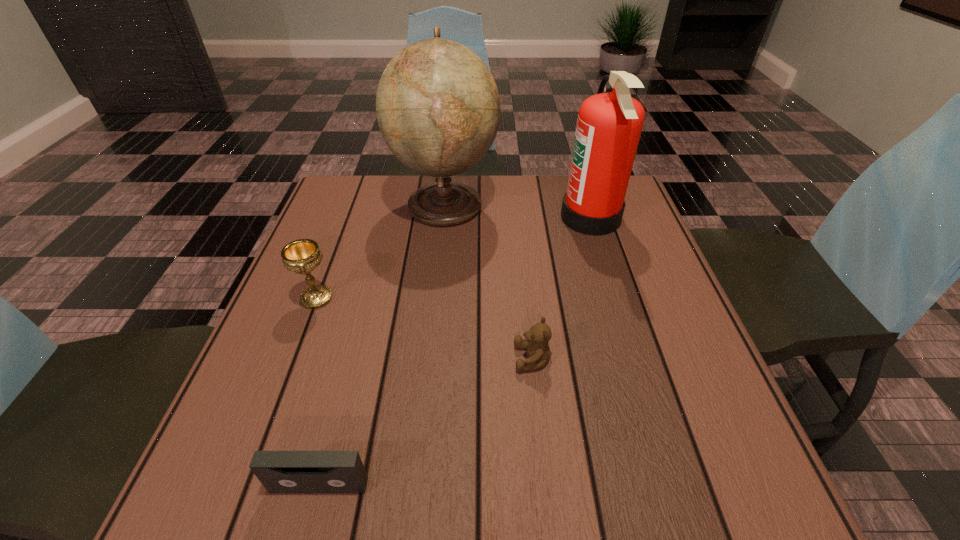
This screenshot has width=960, height=540. I want to click on vacant point located between the videotape and the rightmost object, so click(455, 352).

The width and height of the screenshot is (960, 540). I want to click on vacant space that's between the fourth object from left to right and the leftmost object, so click(x=424, y=328).

Where is `vacant space that's between the fire extinguisher and the nearest object`? Image resolution: width=960 pixels, height=540 pixels. vacant space that's between the fire extinguisher and the nearest object is located at coordinates (455, 352).

This screenshot has width=960, height=540. I want to click on free space between the nearest object and the fourth object from left to right, so coord(426,422).

Locate an element on the screen. This screenshot has width=960, height=540. vacant area that lies between the second nearest object and the rightmost object is located at coordinates (562, 288).

At what (x,y) coordinates should I click in order to perform the action: click on vacant space that's between the nearest object and the second nearest object. Please return your answer as a coordinate pair (x, y). The height and width of the screenshot is (540, 960). Looking at the image, I should click on (426, 422).

Identify the location of vacant space that is in between the globe and the videotape. (382, 345).

The image size is (960, 540). Identify the location of vacant area that lies between the chalice and the teddy bear. (424, 328).

Choose which object is the second nearest neighbor to the rightmost object. Please provide its 2D coordinates. Your answer should be formatted as a tuple, i.e. [(x, y)], where the tuple contains the x and y coordinates of a point satisfying the conditions above.

[(538, 352)]

Identify which object is located as the second nearest to the rightmost object. Please provide its 2D coordinates. Your answer should be formatted as a tuple, i.e. [(x, y)], where the tuple contains the x and y coordinates of a point satisfying the conditions above.

[(538, 352)]